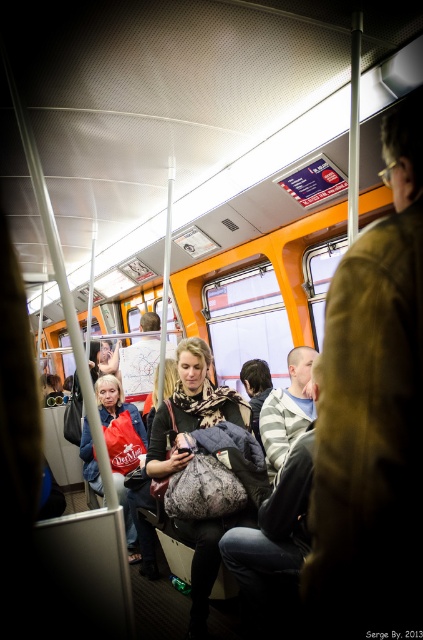
Question: Is brown leather jacket at right positioned at the back of matte red bag at center?

Choices:
 (A) no
 (B) yes

Answer: (A)

Question: Which point is farther from the camera taking this photo?

Choices:
 (A) (390, 378)
 (B) (110, 381)
 (C) (164, 432)

Answer: (B)

Question: Among these points, which one is nearest to the camera?

Choices:
 (A) (125, 429)
 (B) (395, 349)

Answer: (B)

Question: Is leopard print scarf at center in front of matte red bag at center?

Choices:
 (A) yes
 (B) no

Answer: (A)

Question: Which of the following is the farthest from the observer?

Choices:
 (A) matte red bag at center
 (B) leopard print scarf at center
 (C) brown leather jacket at right

Answer: (A)

Question: Does leopard print scarf at center have a larger size compared to matte red bag at center?

Choices:
 (A) yes
 (B) no

Answer: (B)